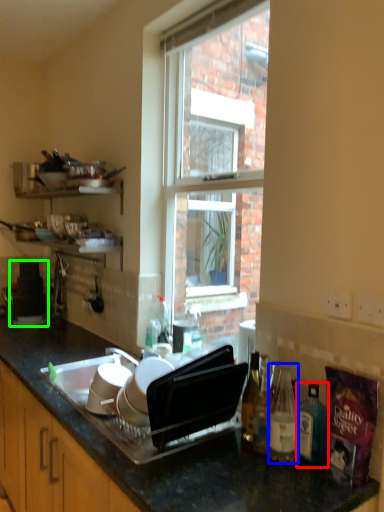
Question: Which object is the farthest from bottle (highlighted by a red box)? Choose among these: bottle (highlighted by a blue box) or appliance (highlighted by a green box).

Choices:
 (A) bottle
 (B) appliance

Answer: (B)